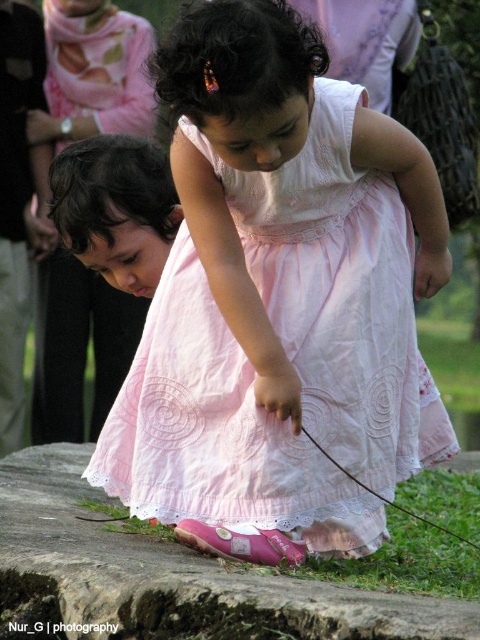
Question: Which object is positioned closest to the pink cotton dress at center?

Choices:
 (A) pink fabric shoe at lower center
 (B) pink fabric dress at lower center

Answer: (A)

Question: In this image, where is pink cotton dress at center located relative to pink fabric dress at lower center?

Choices:
 (A) below
 (B) above

Answer: (B)

Question: Does pink fabric shoe at lower center have a greater width compared to pink fabric dress at lower center?

Choices:
 (A) yes
 (B) no

Answer: (A)

Question: Which object is closer to the camera taking this photo?

Choices:
 (A) pink fabric shoe at lower center
 (B) pink cotton dress at center

Answer: (A)

Question: Which point is closer to the camera?

Choices:
 (A) (15, 536)
 (B) (407, 512)
 (C) (319, 481)

Answer: (A)

Question: Can you confirm if pink fabric shoe at lower center is positioned to the right of pink fabric dress at lower center?

Choices:
 (A) no
 (B) yes

Answer: (A)